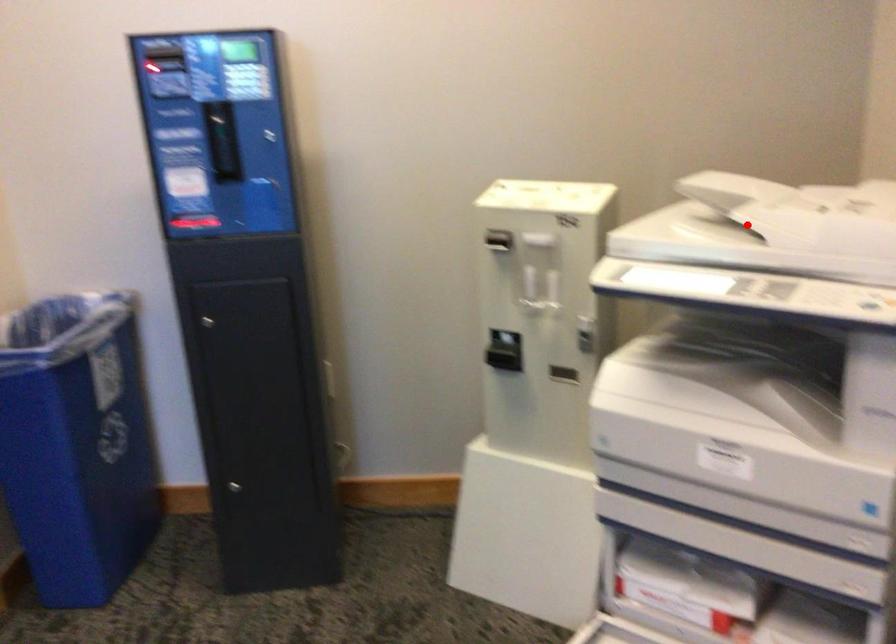
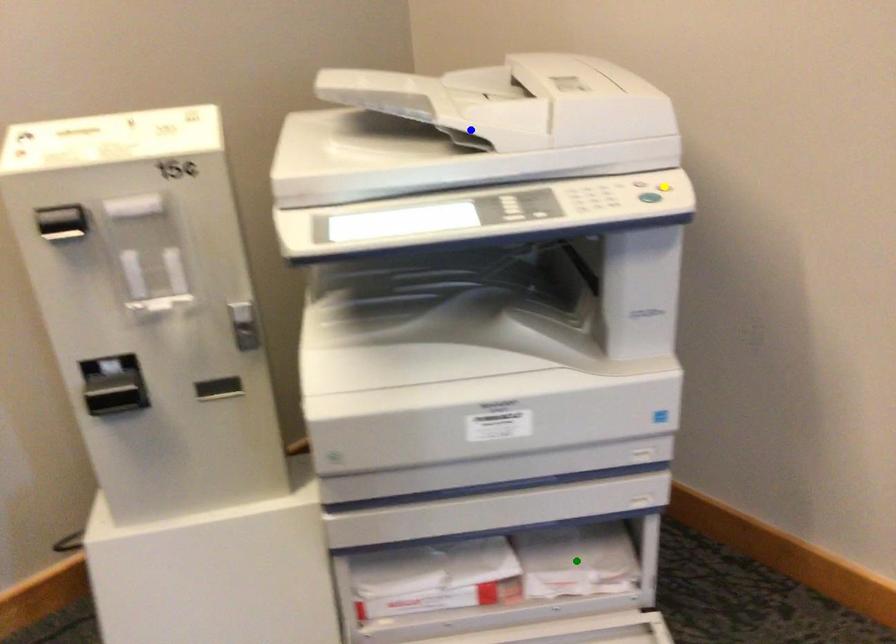
Question: I am providing you with two images of the same scene from different viewpoints. A red point is marked on the first image. You are given multiple points on the second image. In image 2, which mark is for the same physical point as the one in image 1?

Choices:
 (A) yellow point
 (B) blue point
 (C) green point

Answer: (B)